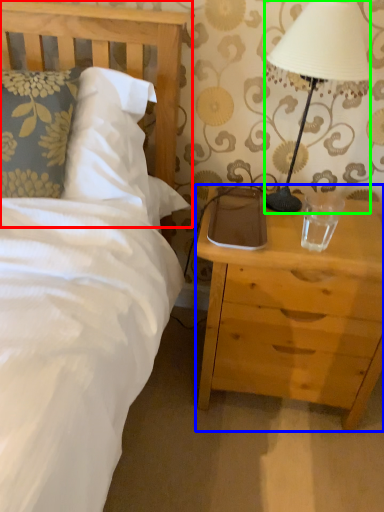
Question: Which object is positioned closest to headboard (highlighted by a red box)? Select from nightstand (highlighted by a blue box) and lamp (highlighted by a green box).

Choices:
 (A) nightstand
 (B) lamp

Answer: (B)